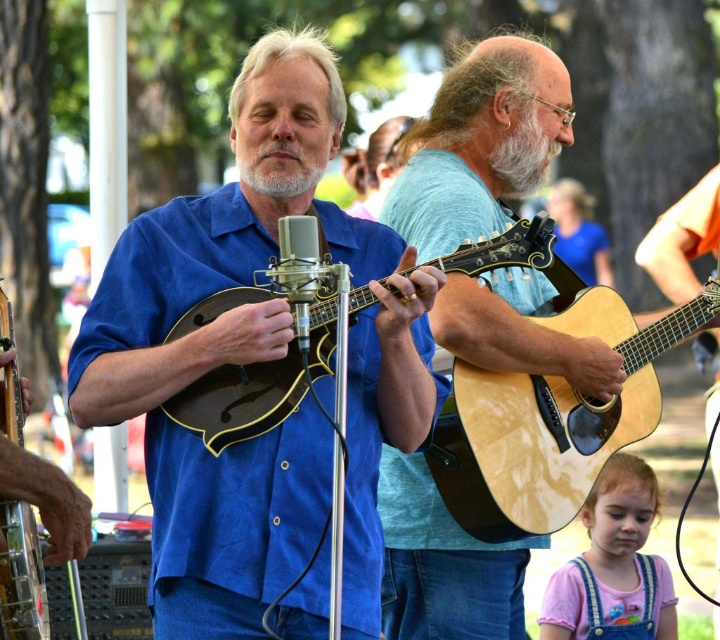
Question: Is natural wood acoustic guitar at center wider than white soft beard at center?

Choices:
 (A) no
 (B) yes

Answer: (B)

Question: Estimate the real-world distances between objects in this image. Which object is farther from the light brown wood guitar at center?

Choices:
 (A) gray matte beard at center
 (B) matte black mandolin at center
 (C) white soft beard at center
 (D) natural wood acoustic guitar at center

Answer: (A)

Question: Considering the relative positions of matte black mandolin at center and pink cotton shirt at lower right in the image provided, where is matte black mandolin at center located with respect to pink cotton shirt at lower right?

Choices:
 (A) left
 (B) right

Answer: (A)

Question: Does natural wood acoustic guitar at center have a smaller size compared to pink cotton shirt at lower right?

Choices:
 (A) no
 (B) yes

Answer: (A)

Question: Which point is closer to the camera?

Choices:
 (A) (234, 384)
 (B) (606, 625)
 (C) (287, 128)

Answer: (A)

Question: Which of the following is the farthest from the observer?

Choices:
 (A) silver metallic microphone at center
 (B) white soft beard at center
 (C) matte brown guitar at center
 (D) pink cotton shirt at lower right

Answer: (C)